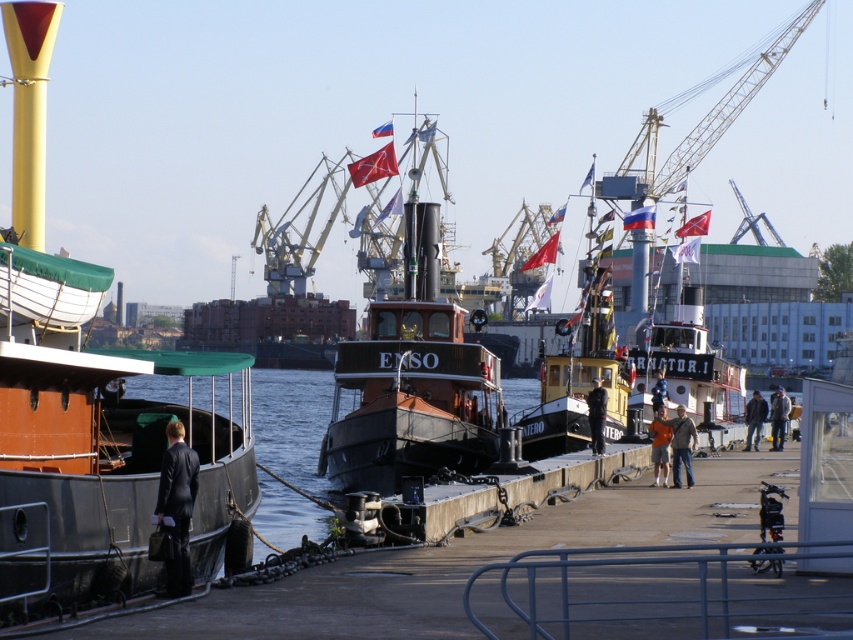
Question: Is matte black boat at left wider than smooth black water at left?

Choices:
 (A) yes
 (B) no

Answer: (B)

Question: Is matte black boat at left to the right of black suit at left from the viewer's perspective?

Choices:
 (A) yes
 (B) no

Answer: (B)

Question: Which object is positioned closest to the metallic red boat at center?

Choices:
 (A) smooth black water at left
 (B) dark blue jeans at center
 (C) red fabric flag at center

Answer: (B)

Question: Where is black suit at left located in relation to brown leather jacket at lower right in the image?

Choices:
 (A) above
 (B) below

Answer: (A)

Question: Which point appears farthest from the camera in this image?

Choices:
 (A) (686, 221)
 (B) (419, 468)

Answer: (A)

Question: Among these points, which one is farthest from the camera?

Choices:
 (A) (73, 404)
 (B) (393, 413)
 (C) (691, 225)

Answer: (C)